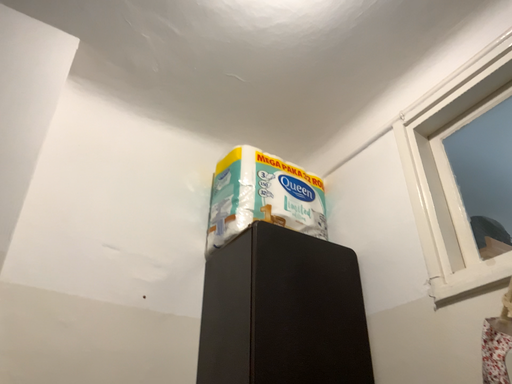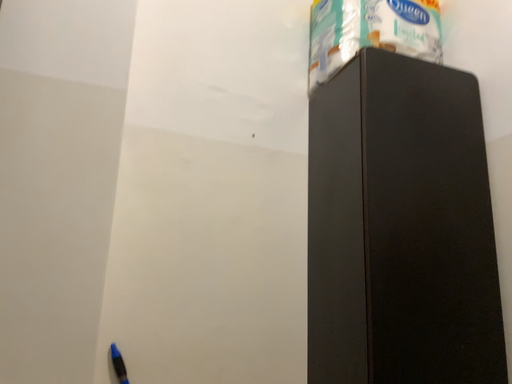
Question: How did the camera likely rotate when shooting the video?

Choices:
 (A) rotated left
 (B) rotated right

Answer: (A)